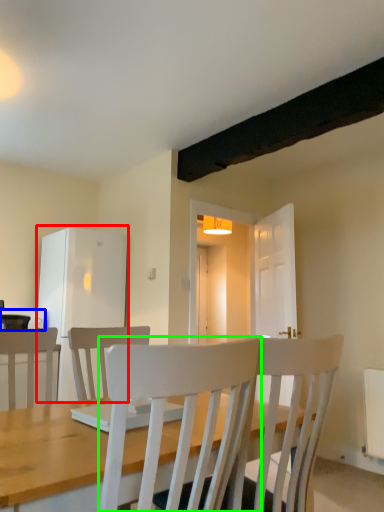
Question: Estimate the real-world distances between objects in this image. Which object is closer to fridge (highlighted by a red box), appliance (highlighted by a blue box) or chair (highlighted by a green box)?

Choices:
 (A) appliance
 (B) chair

Answer: (A)